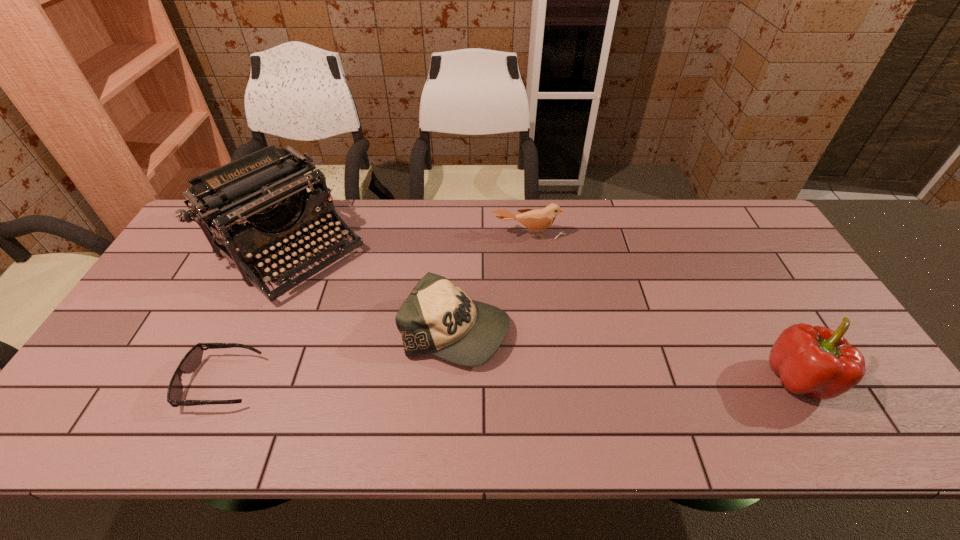
Locate an element on the screen. Image resolution: width=960 pixels, height=540 pixels. free space on the desktop that is between the shortest object and the rightmost object and is positioned at the beak of the bird is located at coordinates (540, 380).

Where is `free spot on the desktop that is between the sunglasses and the pepper and is positioned on the typing side of the tallest object`? free spot on the desktop that is between the sunglasses and the pepper and is positioned on the typing side of the tallest object is located at coordinates (452, 381).

The height and width of the screenshot is (540, 960). In order to click on free spot on the desktop that is between the shortest object and the second tallest object and is positioned on the front-facing side of the baseball cap in this screenshot , I will do `click(559, 380)`.